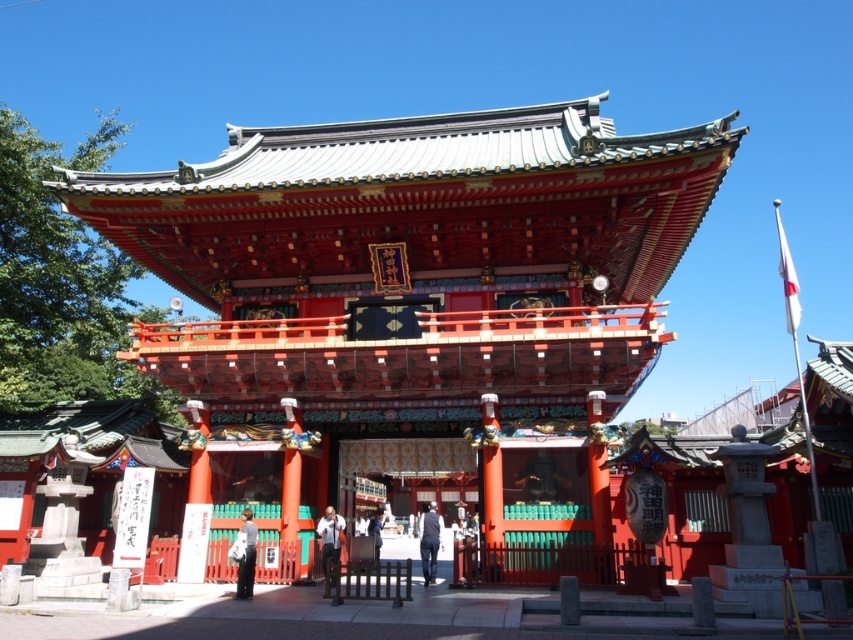
Question: Considering the relative positions of white shirt at center and blue fabric pants at center in the image provided, where is white shirt at center located with respect to blue fabric pants at center?

Choices:
 (A) below
 (B) above

Answer: (B)

Question: Is shiny lacquered shrine gate at center positioned before white shirt at center?

Choices:
 (A) yes
 (B) no

Answer: (A)

Question: Which object is the closest to the shiny lacquered shrine gate at center?

Choices:
 (A) white matte shirt at lower center
 (B) white shirt at center
 (C) blue fabric at center
 (D) blue fabric pants at center

Answer: (B)

Question: Estimate the real-world distances between objects in this image. Which object is farther from the white shirt at center?

Choices:
 (A) blue fabric at center
 (B) white matte shirt at lower center

Answer: (A)

Question: Which of the following is the closest to the observer?

Choices:
 (A) (428, 528)
 (B) (334, 573)

Answer: (B)

Question: Can you confirm if white shirt at center is thinner than white matte shirt at lower center?

Choices:
 (A) no
 (B) yes

Answer: (A)